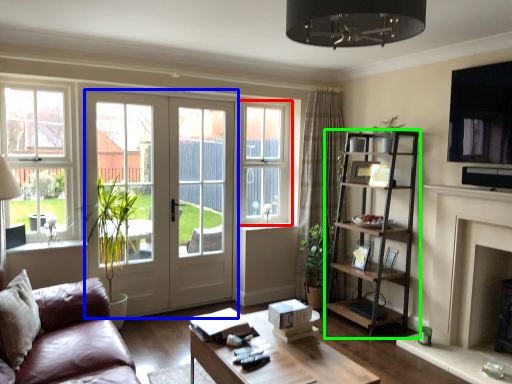
Question: Based on their relative distances, which object is nearer to window (highlighted by a red box)? Choose from door (highlighted by a blue box) and shelf (highlighted by a green box).

Choices:
 (A) door
 (B) shelf

Answer: (A)